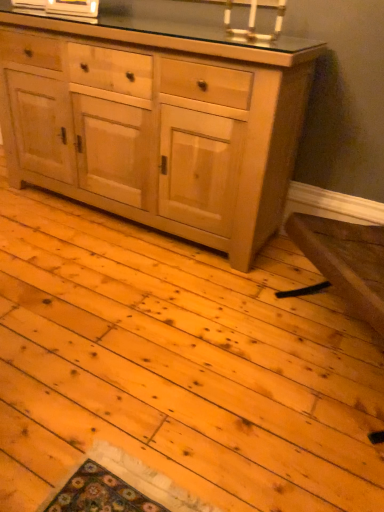
Describe the element at coordinates (254, 19) in the screenshot. The height and width of the screenshot is (512, 384). I see `white ceramic candle holder at upper center` at that location.

The width and height of the screenshot is (384, 512). Identify the location of white ceramic candle holder at upper center. (254, 19).

The image size is (384, 512). I want to click on natural wood cabinet at center, so click(156, 123).

Image resolution: width=384 pixels, height=512 pixels. What do you see at coordinates (156, 123) in the screenshot?
I see `natural wood cabinet at center` at bounding box center [156, 123].

Where is `white ceramic candle holder at upper center`? The width and height of the screenshot is (384, 512). white ceramic candle holder at upper center is located at coordinates (254, 19).

Which object is positioned more to the left, white ceramic candle holder at upper center or natural wood cabinet at center?

From the viewer's perspective, natural wood cabinet at center appears more on the left side.

Is white ceramic candle holder at upper center positioned in front of natural wood cabinet at center?

No.

Is point (252, 36) behind point (187, 126)?

No, (252, 36) is closer to viewer.

From the image's perspective, is white ceramic candle holder at upper center on top of natural wood cabinet at center?

Yes, from the image's perspective, white ceramic candle holder at upper center is on top of natural wood cabinet at center.

From a real-world perspective, between white ceramic candle holder at upper center and natural wood cabinet at center, who is vertically lower?

natural wood cabinet at center, from a real-world perspective.

Is white ceramic candle holder at upper center wider or thinner than natural wood cabinet at center?

Clearly, white ceramic candle holder at upper center has less width compared to natural wood cabinet at center.

Considering the sizes of objects white ceramic candle holder at upper center and natural wood cabinet at center in the image provided, who is taller, white ceramic candle holder at upper center or natural wood cabinet at center?

With more height is natural wood cabinet at center.

Considering the sizes of objects white ceramic candle holder at upper center and natural wood cabinet at center in the image provided, who is bigger, white ceramic candle holder at upper center or natural wood cabinet at center?

Bigger between the two is natural wood cabinet at center.

Would you say white ceramic candle holder at upper center is inside or outside natural wood cabinet at center?

white ceramic candle holder at upper center is not inside natural wood cabinet at center, it's outside.

Is white ceramic candle holder at upper center touching natural wood cabinet at center?

No, white ceramic candle holder at upper center is not making contact with natural wood cabinet at center.

Is white ceramic candle holder at upper center facing towards natural wood cabinet at center?

No.

How many degrees apart are the facing directions of white ceramic candle holder at upper center and natural wood cabinet at center?

The angle between the facing direction of white ceramic candle holder at upper center and the facing direction of natural wood cabinet at center is 0.00382 degrees.

Image resolution: width=384 pixels, height=512 pixels. I want to click on chest of drawers in front of the white ceramic candle holder at upper center, so click(x=156, y=123).

Based on their positions, is natural wood cabinet at center located to the left or right of white ceramic candle holder at upper center?

Based on their positions, natural wood cabinet at center is located to the left of white ceramic candle holder at upper center.

Which object is further away from the camera, natural wood cabinet at center or white ceramic candle holder at upper center?

white ceramic candle holder at upper center is behind.

Which is behind, point (292, 46) or point (225, 18)?

The point (225, 18) is farther.

From the image's perspective, between natural wood cabinet at center and white ceramic candle holder at upper center, which one is located above?

white ceramic candle holder at upper center appears higher in the image.

From the picture: From a real-world perspective, which object rests below the other?

In real-world perspective, natural wood cabinet at center is lower.

Which object is wider, natural wood cabinet at center or white ceramic candle holder at upper center?

Wider between the two is natural wood cabinet at center.

Can you confirm if natural wood cabinet at center is taller than white ceramic candle holder at upper center?

Indeed, natural wood cabinet at center has a greater height compared to white ceramic candle holder at upper center.

Who is bigger, natural wood cabinet at center or white ceramic candle holder at upper center?

Bigger between the two is natural wood cabinet at center.

Is natural wood cabinet at center located outside white ceramic candle holder at upper center?

Yes, natural wood cabinet at center is outside of white ceramic candle holder at upper center.

Is natural wood cabinet at center touching white ceramic candle holder at upper center?

No, natural wood cabinet at center is not in contact with white ceramic candle holder at upper center.

Looking at this image, does natural wood cabinet at center turn towards white ceramic candle holder at upper center?

No, natural wood cabinet at center is not facing towards white ceramic candle holder at upper center.

I want to click on the chest of drawers located underneath the white ceramic candle holder at upper center (from a real-world perspective), so click(156, 123).

You are a GUI agent. You are given a task and a screenshot of the screen. Output one action in this format:
    pyautogui.click(x=<x>, y=<y>)
    Task: Click on the candle holder above the natural wood cabinet at center (from a real-world perspective)
    The height and width of the screenshot is (512, 384).
    Given the screenshot: What is the action you would take?
    pyautogui.click(x=254, y=19)

In the image, there is a white ceramic candle holder at upper center. At what (x,y) coordinates should I click in order to perform the action: click on the chest of drawers below it (from the image's perspective). Please return your answer as a coordinate pair (x, y). The image size is (384, 512). Looking at the image, I should click on (156, 123).